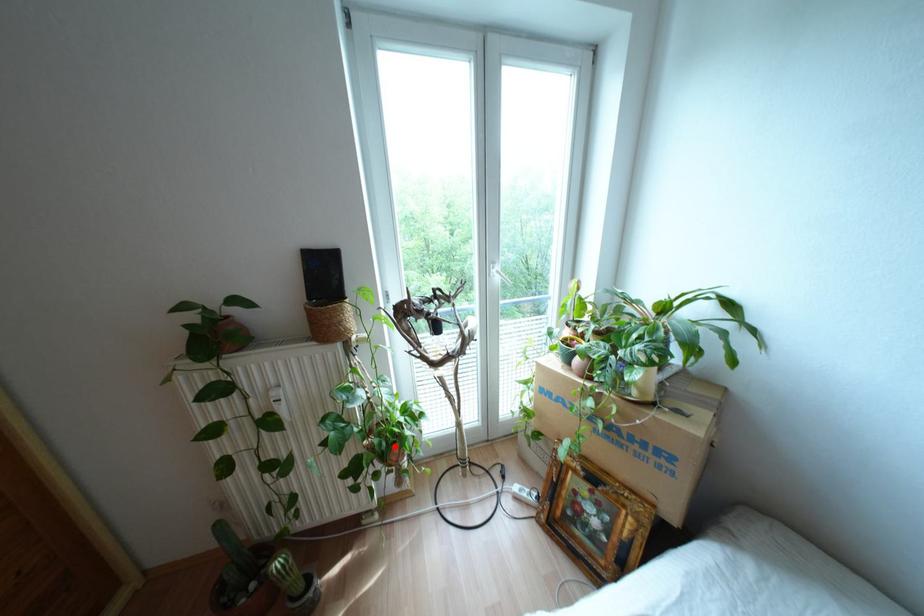
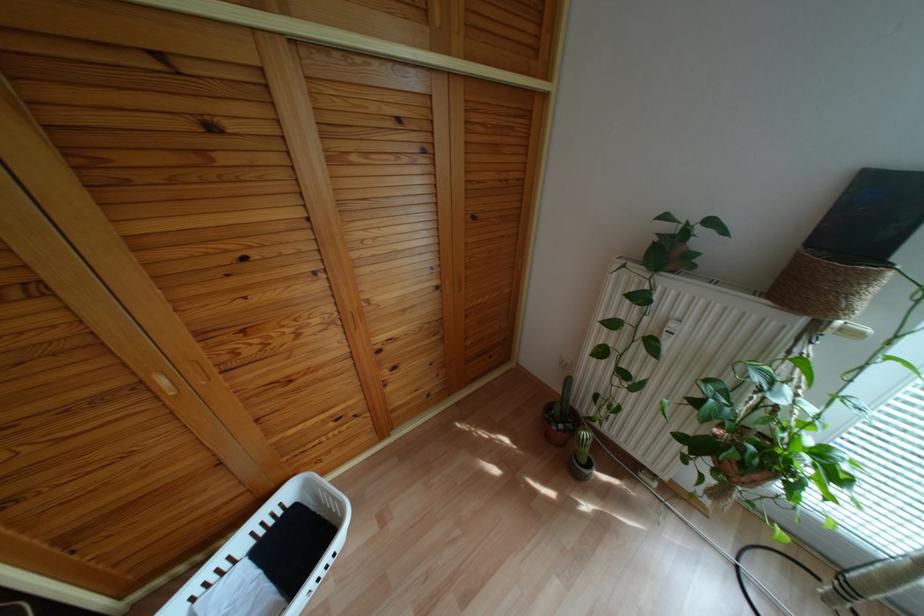
The point at the highlighted location is marked in the first image. Where is the corresponding point in the second image?

(763, 474)